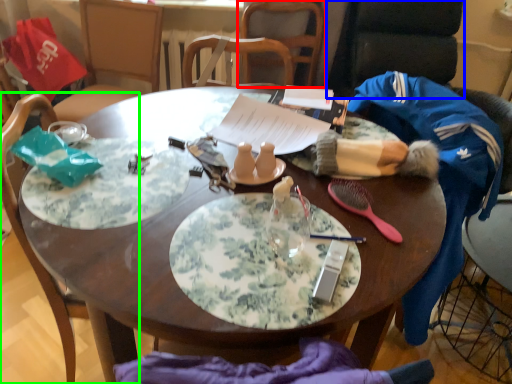
Question: Based on their relative distances, which object is nearer to chair (highlighted by a red box)? Choose from armchair (highlighted by a blue box) and chair (highlighted by a green box).

Choices:
 (A) armchair
 (B) chair

Answer: (A)